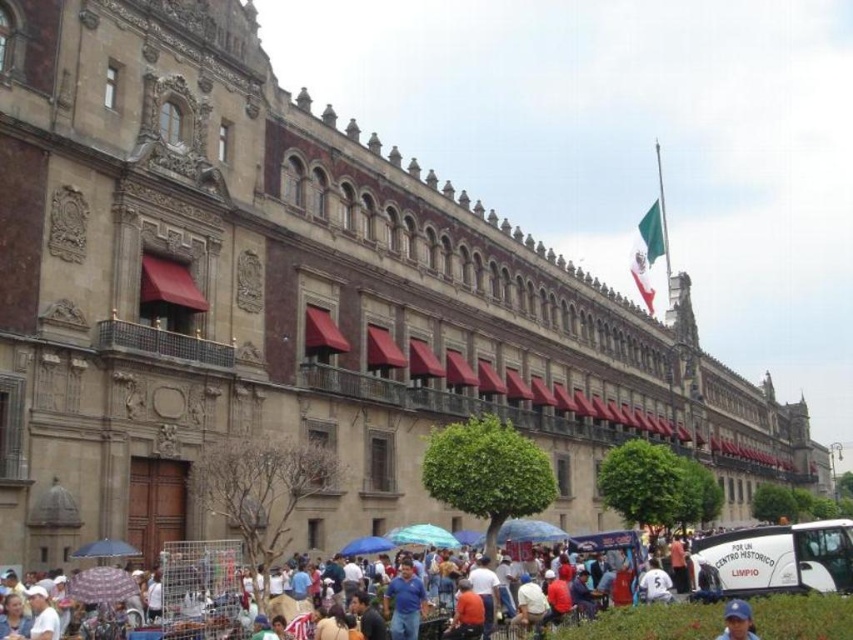
You are a photographer standing in front of the historic building and want to take a photo of the blue fabric cap at lower center without the white cotton crowd at lower center blocking it. How can you adjust your position or angle to achieve this?

Since the white cotton crowd at lower center is much taller than the blue fabric cap at lower center, you can lower your camera angle or move to a lower position to capture the blue fabric cap at lower center while avoiding the obstruction from the taller crowd.

You are a photographer standing at the camera position. You want to capture a photo of the transparent plastic umbrella at lower left without any obstructions. Given that the distance between the camera and the umbrella is 158.33 feet, is this feasible with a standard zoom lens that has a maximum zoom range of 200mm?

The distance between the transparent plastic umbrella at lower left and the camera is 158.33 feet. A standard zoom lens with a maximum of 200mm can effectively capture distant subjects up to around 150 feet, so it might be challenging to get a clear, unobstructed photo of the transparent plastic umbrella at lower left without obstructions at this distance.

You are standing at the entrance of the grand historic building and want to take a photo of the white cotton crowd at lower center. According to the coordinates provided, where should you aim your camera to capture them?

The white cotton crowd at lower center is located at coordinates point [630,612], so aim your camera towards that specific point to capture them.